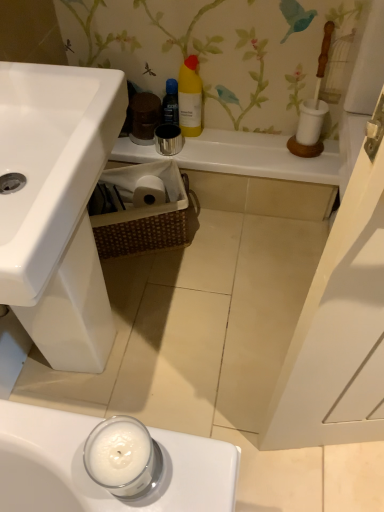
Question: Is black plastic spray can at upper center turned away from white ceramic counter top at upper center?

Choices:
 (A) no
 (B) yes

Answer: (A)

Question: Does black plastic spray can at upper center have a greater width compared to white ceramic counter top at upper center?

Choices:
 (A) no
 (B) yes

Answer: (A)

Question: Is black plastic spray can at upper center shorter than white ceramic counter top at upper center?

Choices:
 (A) yes
 (B) no

Answer: (B)

Question: Considering the relative sizes of black plastic spray can at upper center and white ceramic counter top at upper center in the image provided, is black plastic spray can at upper center taller than white ceramic counter top at upper center?

Choices:
 (A) no
 (B) yes

Answer: (B)

Question: Can you confirm if black plastic spray can at upper center is bigger than white ceramic counter top at upper center?

Choices:
 (A) no
 (B) yes

Answer: (A)

Question: Is there a large distance between black plastic spray can at upper center and white ceramic counter top at upper center?

Choices:
 (A) yes
 (B) no

Answer: (B)

Question: From a real-world perspective, does yellow plastic bottle at upper center stand above white ceramic counter top at upper center?

Choices:
 (A) yes
 (B) no

Answer: (A)

Question: Considering the relative sizes of yellow plastic bottle at upper center and white ceramic counter top at upper center in the image provided, is yellow plastic bottle at upper center wider than white ceramic counter top at upper center?

Choices:
 (A) no
 (B) yes

Answer: (A)

Question: Considering the relative sizes of yellow plastic bottle at upper center and white ceramic counter top at upper center in the image provided, is yellow plastic bottle at upper center shorter than white ceramic counter top at upper center?

Choices:
 (A) yes
 (B) no

Answer: (B)

Question: Could you tell me if yellow plastic bottle at upper center is turned towards white ceramic counter top at upper center?

Choices:
 (A) yes
 (B) no

Answer: (B)

Question: Is yellow plastic bottle at upper center to the right of white ceramic counter top at upper center from the viewer's perspective?

Choices:
 (A) no
 (B) yes

Answer: (A)

Question: Can you confirm if yellow plastic bottle at upper center is taller than white ceramic counter top at upper center?

Choices:
 (A) no
 (B) yes

Answer: (B)

Question: Is white ceramic counter top at upper center next to yellow plastic bottle at upper center and touching it?

Choices:
 (A) no
 (B) yes

Answer: (A)